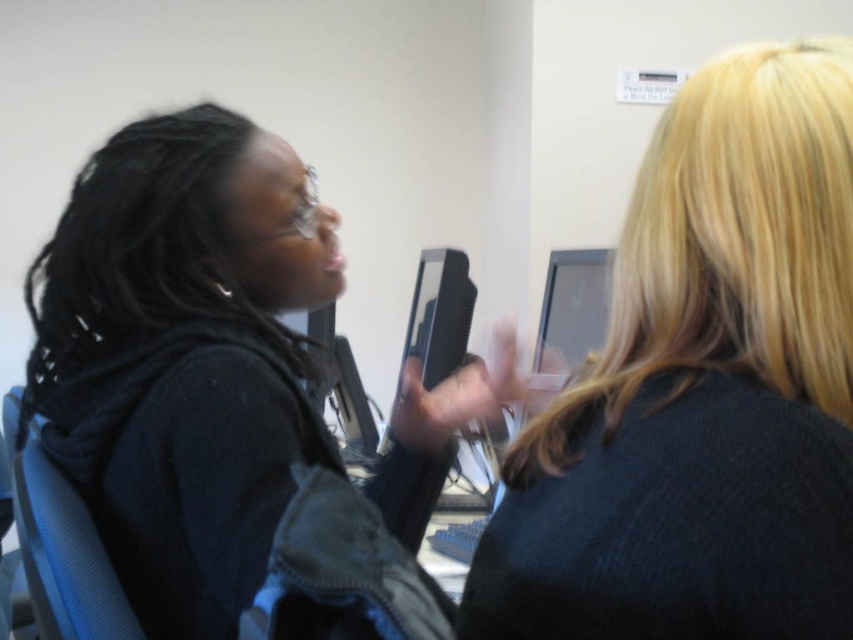
Question: Considering the relative positions of black matte jacket at center and blue fabric chair at left in the image provided, where is black matte jacket at center located with respect to blue fabric chair at left?

Choices:
 (A) left
 (B) right

Answer: (B)

Question: Considering the real-world distances, which object is farthest from the blue fabric chair at left?

Choices:
 (A) blonde hair at upper right
 (B) matte black monitor at center
 (C) black matte jacket at center

Answer: (B)

Question: Among these objects, which one is farthest from the camera?

Choices:
 (A) blonde hair at upper right
 (B) blue fabric chair at left

Answer: (B)

Question: Which point appears closest to the camera in this image?

Choices:
 (A) (35, 449)
 (B) (793, 148)
 (C) (238, 392)
 (D) (592, 349)

Answer: (B)

Question: Considering the relative positions of blonde hair at upper right and blue fabric chair at left in the image provided, where is blonde hair at upper right located with respect to blue fabric chair at left?

Choices:
 (A) above
 (B) below

Answer: (A)

Question: Can you confirm if blonde hair at upper right is wider than black matte jacket at center?

Choices:
 (A) no
 (B) yes

Answer: (A)